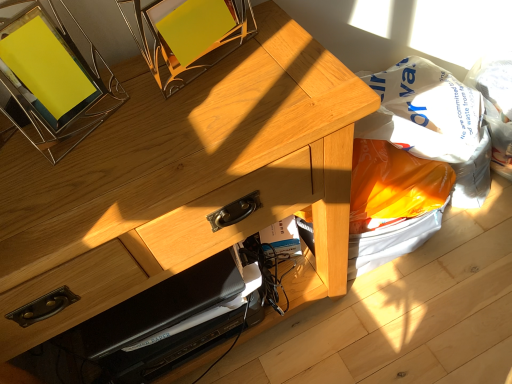
Question: Does white plastic grocery bag at lower right have a greater height compared to natural wood desk at center?

Choices:
 (A) yes
 (B) no

Answer: (B)

Question: Considering the relative sizes of white plastic grocery bag at lower right and natural wood desk at center in the image provided, is white plastic grocery bag at lower right bigger than natural wood desk at center?

Choices:
 (A) no
 (B) yes

Answer: (A)

Question: Can you confirm if white plastic grocery bag at lower right is wider than natural wood desk at center?

Choices:
 (A) no
 (B) yes

Answer: (A)

Question: Could you tell me if white plastic grocery bag at lower right is facing natural wood desk at center?

Choices:
 (A) no
 (B) yes

Answer: (A)

Question: Does white plastic grocery bag at lower right have a lesser height compared to natural wood desk at center?

Choices:
 (A) yes
 (B) no

Answer: (A)

Question: From a real-world perspective, is metallic yellow picture frame at upper left positioned above or below orange plastic bag at lower right?

Choices:
 (A) below
 (B) above

Answer: (B)

Question: Is point (33, 1) positioned closer to the camera than point (419, 170)?

Choices:
 (A) farther
 (B) closer

Answer: (B)

Question: From the image's perspective, is metallic yellow picture frame at upper left above or below orange plastic bag at lower right?

Choices:
 (A) above
 (B) below

Answer: (A)

Question: From their relative heights in the image, would you say metallic yellow picture frame at upper left is taller or shorter than orange plastic bag at lower right?

Choices:
 (A) short
 (B) tall

Answer: (B)

Question: Considering the positions of point (394, 91) and point (274, 48), is point (394, 91) closer or farther from the camera than point (274, 48)?

Choices:
 (A) closer
 (B) farther

Answer: (B)

Question: Is white plastic grocery bag at lower right to the left or to the right of natural wood desk at center in the image?

Choices:
 (A) left
 (B) right

Answer: (B)

Question: Considering the positions of white plastic grocery bag at lower right and natural wood desk at center in the image, is white plastic grocery bag at lower right wider or thinner than natural wood desk at center?

Choices:
 (A) thin
 (B) wide

Answer: (A)

Question: In the image, is white plastic grocery bag at lower right positioned in front of or behind natural wood desk at center?

Choices:
 (A) front
 (B) behind

Answer: (B)

Question: Is orange plastic bag at lower right taller or shorter than metallic yellow picture frame at upper left?

Choices:
 (A) short
 (B) tall

Answer: (A)

Question: Based on their positions, is orange plastic bag at lower right located to the left or right of metallic yellow picture frame at upper left?

Choices:
 (A) right
 (B) left

Answer: (A)